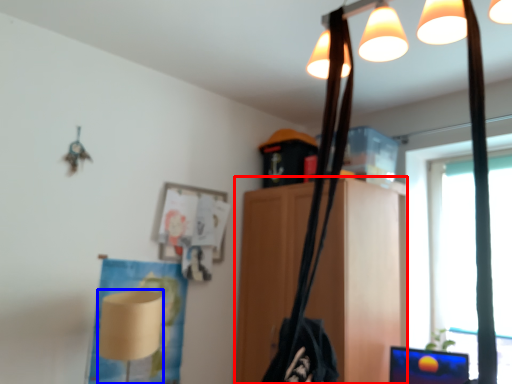
Question: Which of the following is the closest to the observer, furniture (highlighted by a red box) or lamp (highlighted by a blue box)?

Choices:
 (A) furniture
 (B) lamp

Answer: (B)